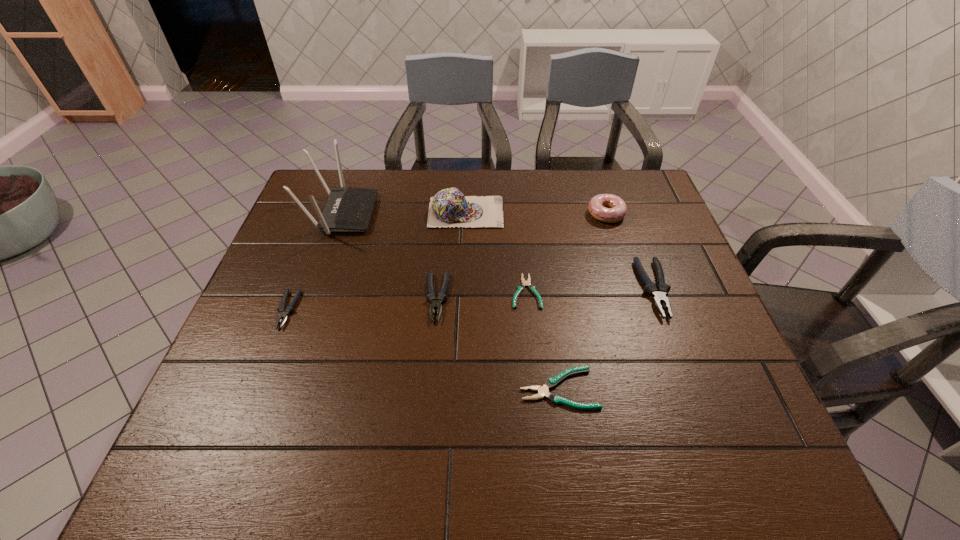
Image resolution: width=960 pixels, height=540 pixels. In order to click on the nearer teal pliers in this screenshot , I will do `click(543, 391)`.

This screenshot has width=960, height=540. What are the coordinates of `the second shortest pliers` in the screenshot? It's located at (543, 391).

Identify the location of the smaller teal pliers. This screenshot has height=540, width=960. (521, 287).

Where is `the shortest pliers`? the shortest pliers is located at coordinates (521, 287).

The image size is (960, 540). Identify the location of vacant area situated 0.100m on the front-facing side of the router. (407, 213).

This screenshot has width=960, height=540. I want to click on vacant space located on the front, side, and top of the seventh shortest object, so click(617, 212).

Locate an element on the screen. vacant space situated on the left of the pink doughnut is located at coordinates (568, 214).

The width and height of the screenshot is (960, 540). Find the location of `free space located at the gripping part of the biggest gray pliers`. free space located at the gripping part of the biggest gray pliers is located at coordinates (706, 428).

Locate an element on the screen. The height and width of the screenshot is (540, 960). vacant space located 0.320m at the gripping part of the second gray pliers from right to left is located at coordinates (423, 458).

At what (x,y) coordinates should I click in order to perform the action: click on free spot located at the gripping part of the leftmost pliers. Please return your answer as a coordinate pair (x, y). Image resolution: width=960 pixels, height=540 pixels. Looking at the image, I should click on (241, 427).